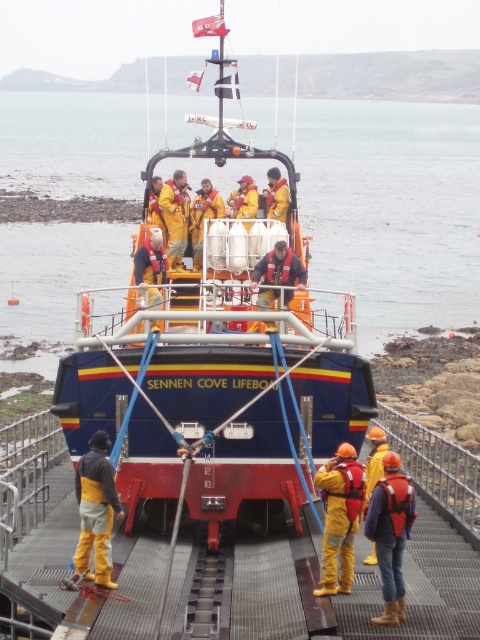
Which of these two, orange fabric jacket at center or yellow matte life jacket at center, stands shorter?

With less height is orange fabric jacket at center.

Does orange fabric jacket at center have a greater height compared to yellow matte life jacket at center?

No, orange fabric jacket at center is not taller than yellow matte life jacket at center.

Is point (395, 515) more distant than point (196, 205)?

No, (395, 515) is in front of (196, 205).

The width and height of the screenshot is (480, 640). What are the coordinates of `orange fabric jacket at center` in the screenshot? It's located at (391, 534).

Can you confirm if blue painted fiberglass sennen cove lifeboat at center is bigger than yellow waterproof suit at lower left?

Yes, blue painted fiberglass sennen cove lifeboat at center is bigger than yellow waterproof suit at lower left.

Between blue painted fiberglass sennen cove lifeboat at center and yellow waterproof suit at lower left, which one is positioned higher?

Positioned higher is blue painted fiberglass sennen cove lifeboat at center.

Which is behind, point (179, 280) or point (85, 513)?

Positioned behind is point (179, 280).

What are the coordinates of `blue painted fiberglass sennen cove lifeboat at center` in the screenshot? It's located at (216, 353).

Locate an element on the screen. The width and height of the screenshot is (480, 640). blue glossy water at center is located at coordinates (393, 211).

Between blue glossy water at center and yellow waterproof suit at lower left, which one appears on the right side from the viewer's perspective?

blue glossy water at center is more to the right.

Identify the location of blue glossy water at center. pos(393,211).